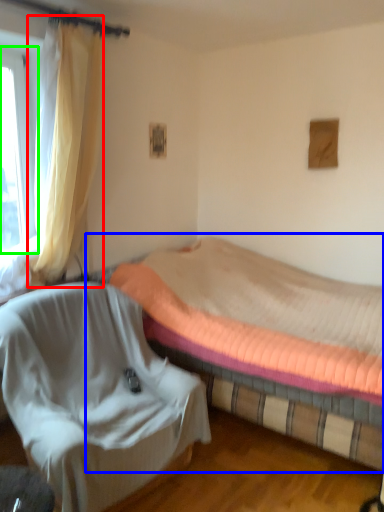
Question: Based on their relative distances, which object is farther from curtain (highlighted by a red box)? Choose from bed (highlighted by a blue box) and window (highlighted by a green box).

Choices:
 (A) bed
 (B) window

Answer: (A)